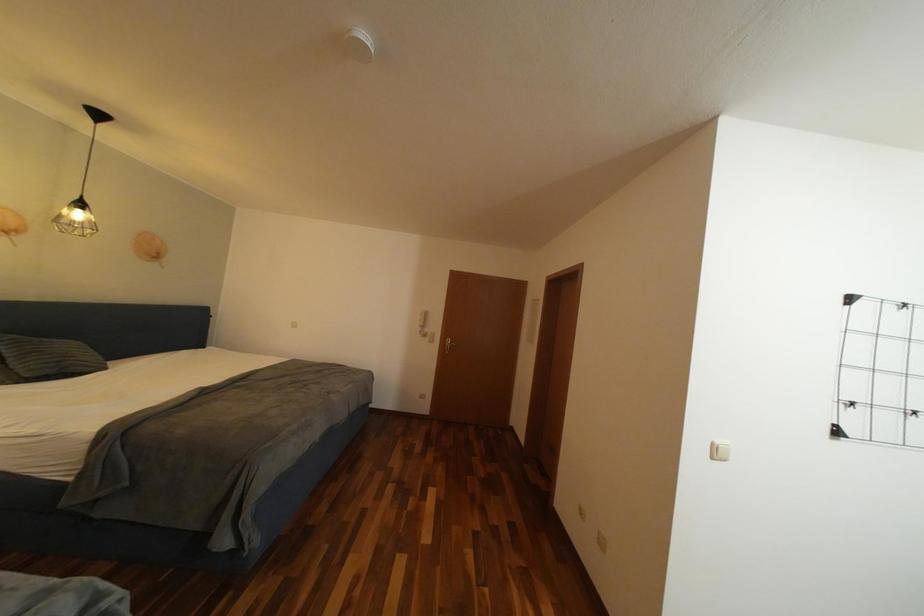
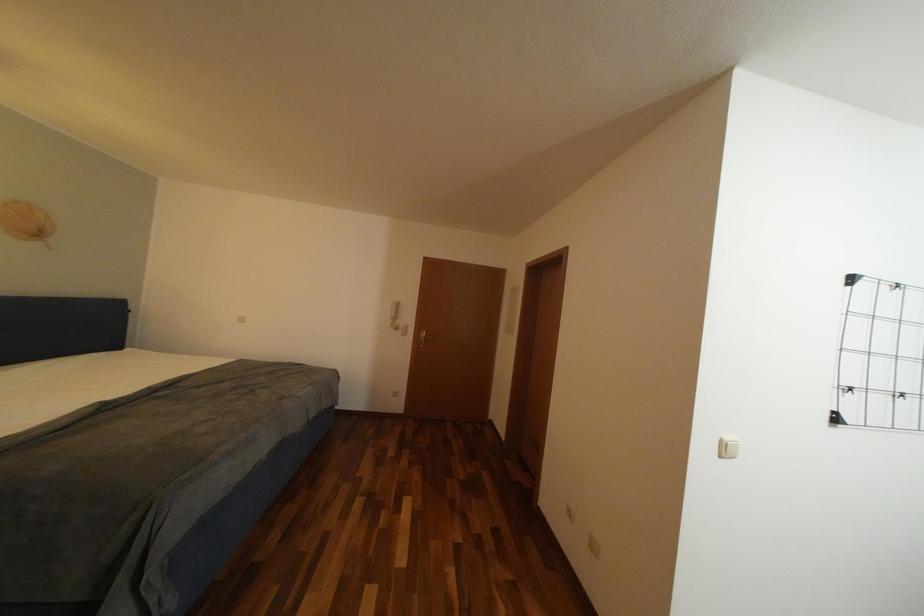
Question: Based on the continuous images, in which direction is the camera rotating? Reply with the corresponding letter.

Choices:
 (A) Left
 (B) Right
 (C) Up
 (D) Down

Answer: (B)